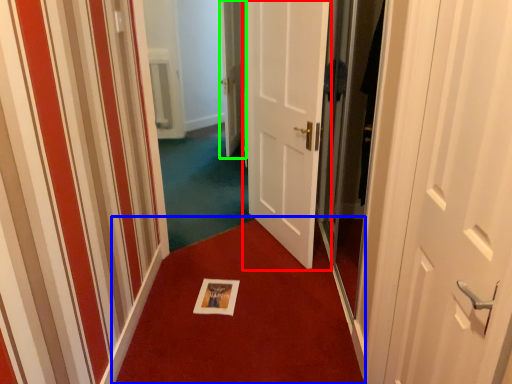
Question: Which is farther away from door (highlighted by a red box)? doormat (highlighted by a blue box) or door (highlighted by a green box)?

Choices:
 (A) doormat
 (B) door

Answer: (A)